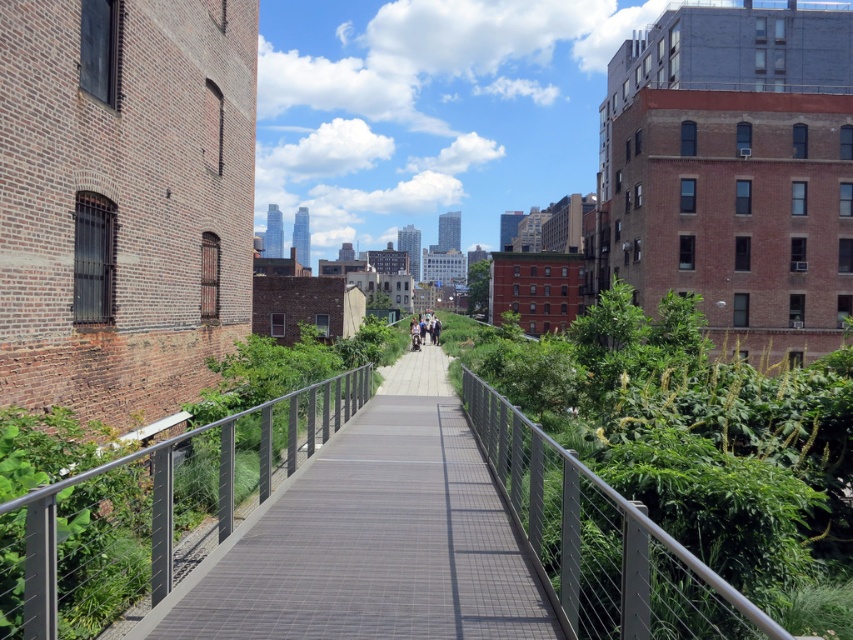
You are a maintenance worker needing to inspect both the metallic gray bridge at center and the metallic gray rail at center. Which object should you check first if you want to start with the one nearest to you?

You should check the metallic gray bridge at center first because it is closer to you than the metallic gray rail at center.